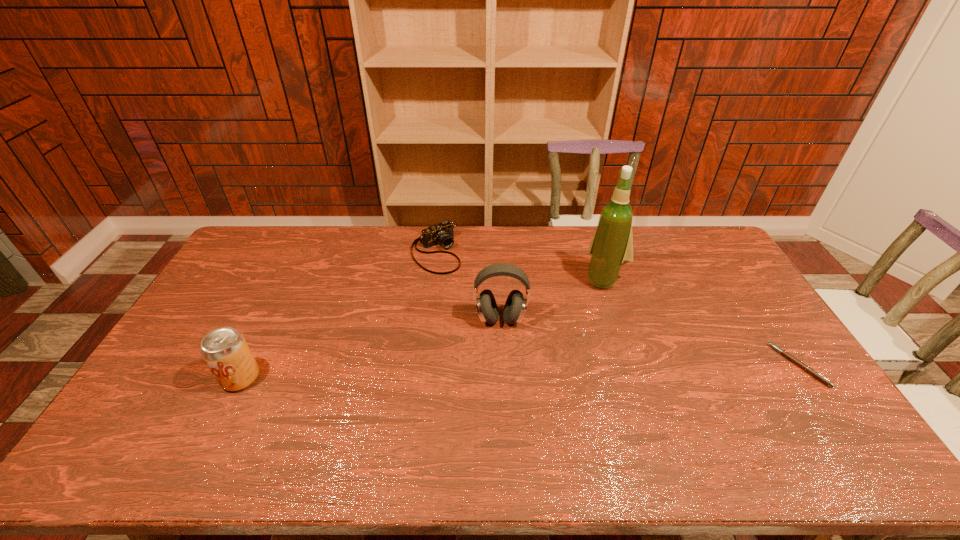
Select which object is the closest to the pop (soda). Please provide its 2D coordinates. Your answer should be formatted as a tuple, i.e. [(x, y)], where the tuple contains the x and y coordinates of a point satisfying the conditions above.

[(442, 233)]

Point out which object is positioned as the second nearest to the fourth object from left to right. Please provide its 2D coordinates. Your answer should be formatted as a tuple, i.e. [(x, y)], where the tuple contains the x and y coordinates of a point satisfying the conditions above.

[(808, 369)]

This screenshot has width=960, height=540. What are the coordinates of `free location that satisfies the following two spatial constraints: 1. on the front side of the tallest object; 2. on the left side of the second shortest object` in the screenshot? It's located at (433, 279).

Locate an element on the screen. This screenshot has width=960, height=540. free spot that satisfies the following two spatial constraints: 1. on the back side of the pop (soda); 2. on the left side of the second tallest object is located at coordinates (270, 319).

I want to click on free location that satisfies the following two spatial constraints: 1. on the front side of the camera; 2. at the nib of the rightmost object, so click(422, 365).